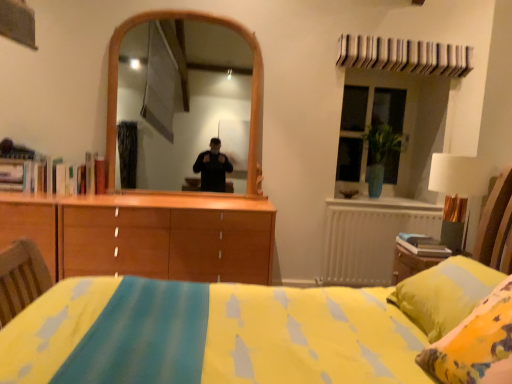
Where is `free space above white metallic radiator at right (from a real-world perspective)`? free space above white metallic radiator at right (from a real-world perspective) is located at coordinates (385, 201).